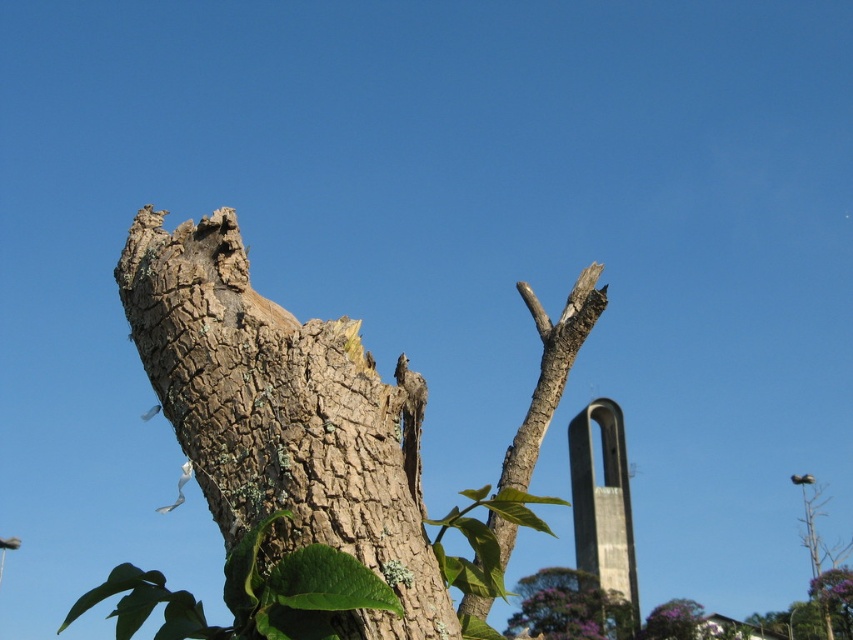
You are a botanist examining the tree trunk. The coordinates provided are in a normalized scale from 0 to 1, where 0 is the bottom left corner of the image. Can you determine the position of the brown rough bark at center relative to the bottom left corner of the image?

The brown rough bark at center is located at point 0.652 on the x axis and 0.333 on the y axis relative to the bottom left corner of the image.

You are standing in front of the tree trunk and notice two points marked on it. One is at coordinates point (x=602, y=433) and the other at point (x=664, y=609). Which point is closer to you?

Point (x=602, y=433) is closer to you because it is further to the viewer than point (x=664, y=609).